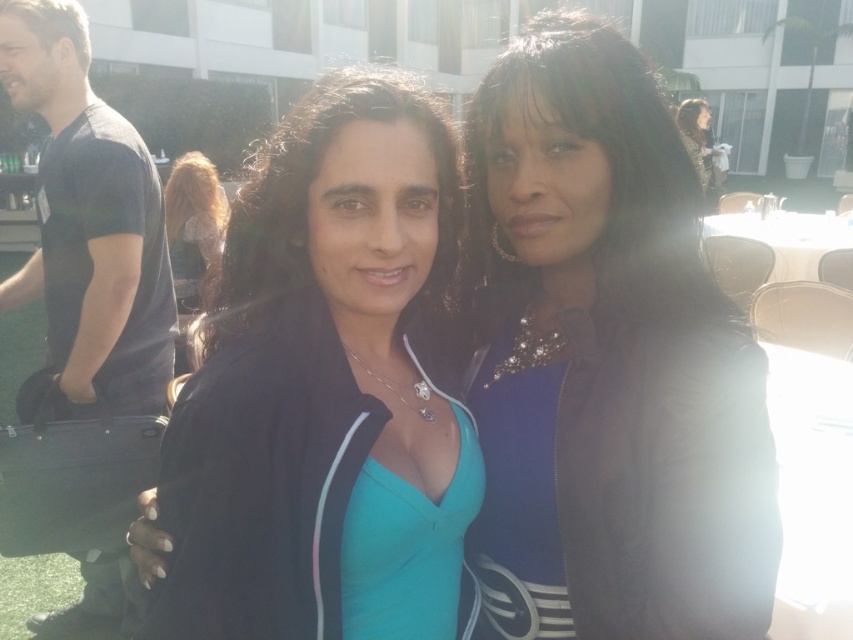
Question: Among these points, which one is nearest to the camera?

Choices:
 (A) (618, 109)
 (B) (202, 224)
 (C) (102, 237)
 (D) (706, 144)

Answer: (A)

Question: Among these objects, which one is farthest from the camera?

Choices:
 (A) dark brown hair at center
 (B) shiny black hair at center
 (C) shiny black jacket at upper right
 (D) blonde hair at upper left

Answer: (C)

Question: Can you confirm if satin black jacket at center is bigger than black matte t-shirt at left?

Choices:
 (A) no
 (B) yes

Answer: (A)

Question: Considering the real-world distances, which object is closest to the satin black jacket at center?

Choices:
 (A) blonde hair at upper left
 (B) black matte t-shirt at left
 (C) shiny black jacket at upper right
 (D) shiny black hair at center

Answer: (D)

Question: Does satin black jacket at center have a lesser width compared to blonde hair at upper left?

Choices:
 (A) no
 (B) yes

Answer: (B)

Question: Does satin black jacket at center appear on the left side of matte black jacket at center?

Choices:
 (A) yes
 (B) no

Answer: (B)